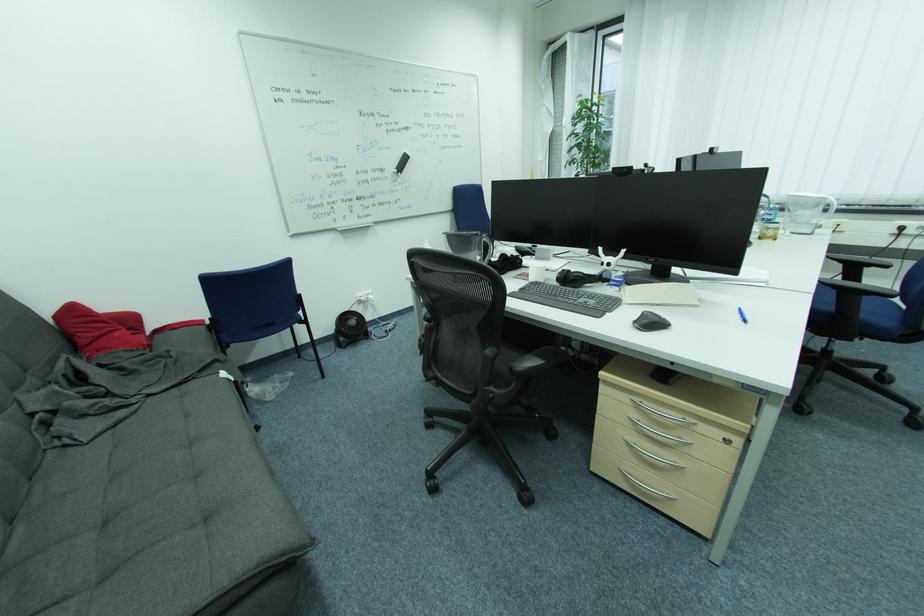
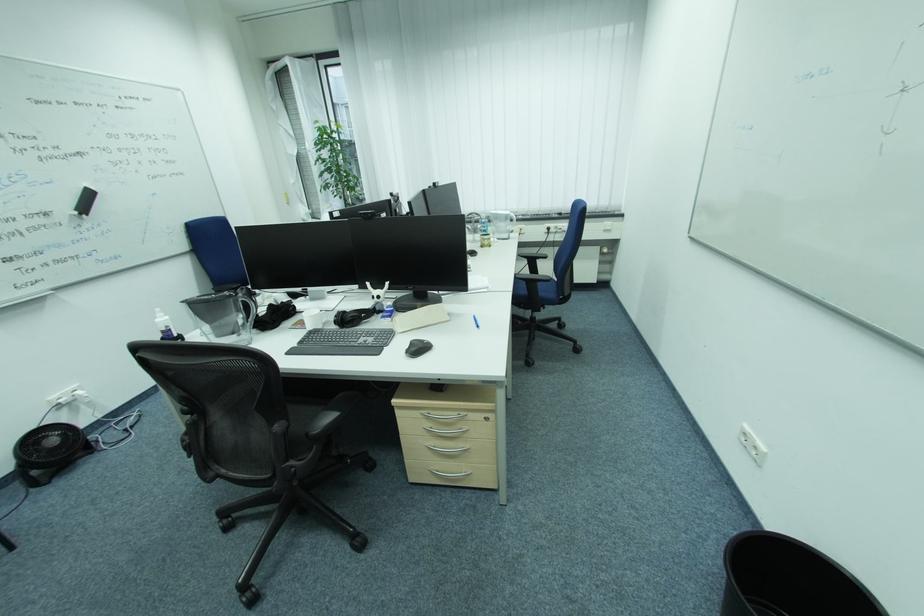
Locate, in the second image, the point that corresponds to pixel 636 476 in the first image.

(444, 472)